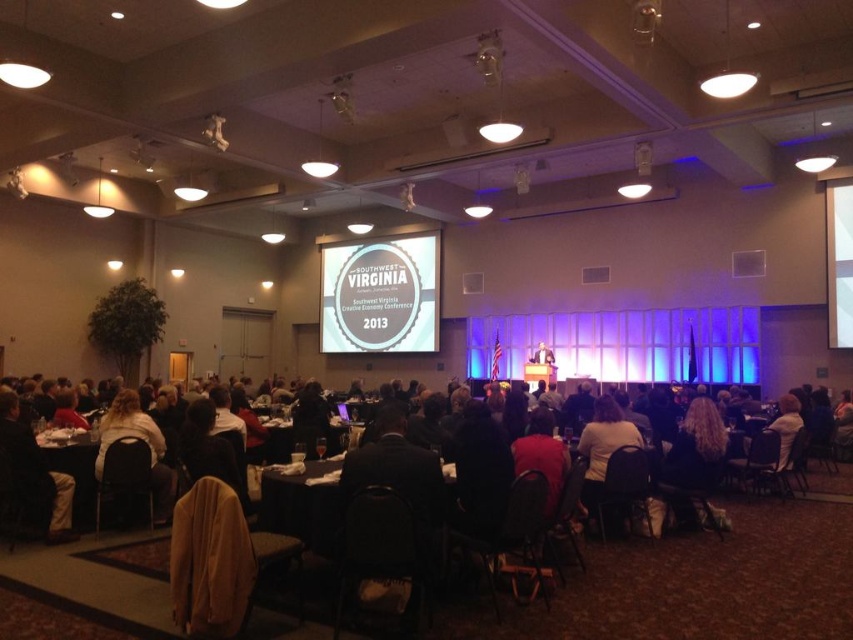
Which is behind, point (380, 337) or point (276, 480)?

The point (380, 337) is behind.

Which is above, matte white sign at center or black fabric table at center?

matte white sign at center is higher up.

Locate an element on the screen. This screenshot has height=640, width=853. matte white sign at center is located at coordinates click(x=380, y=296).

Where is `matte white sign at center`? The width and height of the screenshot is (853, 640). matte white sign at center is located at coordinates (380, 296).

Does point (15, 488) come closer to viewer compared to point (91, 528)?

Yes.

You are a GUI agent. You are given a task and a screenshot of the screen. Output one action in this format:
    pyautogui.click(x=<x>, y=<y>)
    Task: Click on the dark brown leather jacket at lower left
    Image resolution: width=853 pixels, height=640 pixels.
    Given the screenshot: What is the action you would take?
    pyautogui.click(x=33, y=474)

Does matte white sign at center appear over wooden table at lower left?

Correct, matte white sign at center is located above wooden table at lower left.

Between point (361, 323) and point (86, 493), which one is positioned behind?

The point (361, 323) is behind.

Is point (402, 266) positioned after point (73, 442)?

Yes, it is behind point (73, 442).

Where is `matte white sign at center`? This screenshot has height=640, width=853. matte white sign at center is located at coordinates (380, 296).